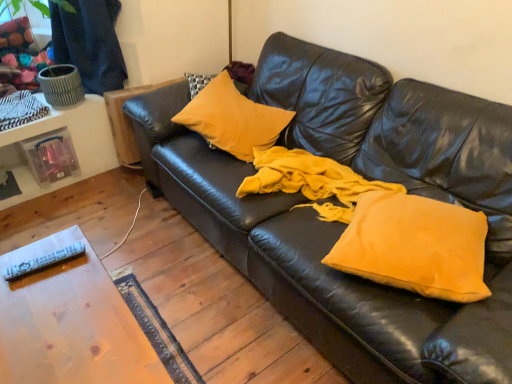
Where is `free space in front of white plastic remote at lower left`? free space in front of white plastic remote at lower left is located at coordinates (35, 298).